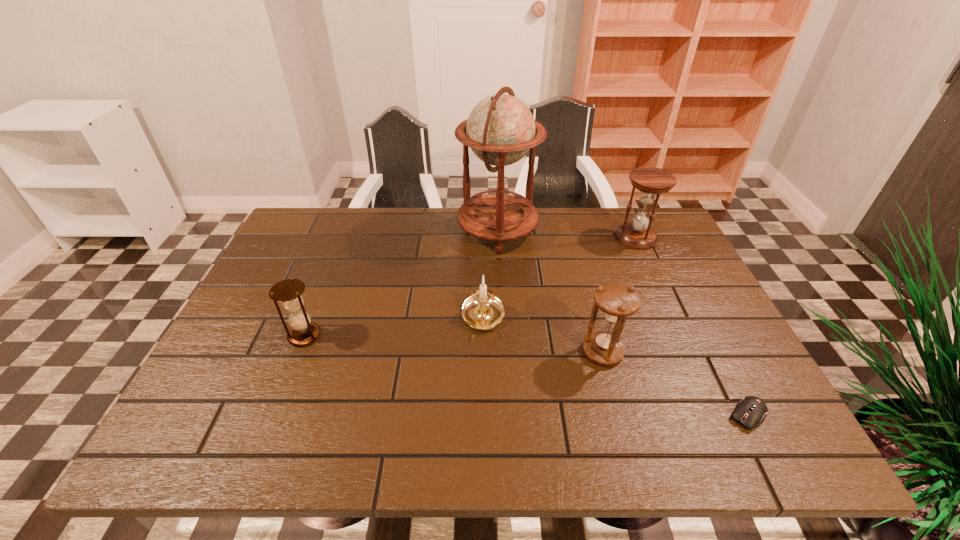
What are the coordinates of `hourglass situated at the right edge` in the screenshot? It's located at (650, 181).

Identify the location of computer mouse that is at the right edge. The image size is (960, 540). (751, 410).

Where is `object at the far right corner`? object at the far right corner is located at coordinates (650, 181).

Image resolution: width=960 pixels, height=540 pixels. I want to click on object at the near right corner, so click(751, 410).

You are a GUI agent. You are given a task and a screenshot of the screen. Output one action in this format:
    pyautogui.click(x=<x>, y=<y>)
    Task: Click on the free spot at the far edge of the desktop
    
    Given the screenshot: What is the action you would take?
    pyautogui.click(x=548, y=248)

What are the coordinates of `free spot at the near edge of the desktop` in the screenshot? It's located at (402, 429).

I want to click on free space at the left edge of the desktop, so click(308, 287).

Identify the location of vacant position at the right edge of the desktop. (710, 301).

I want to click on vacant space at the far left corner of the desktop, so click(x=306, y=227).

I want to click on free space that is in between the leftmost object and the globe, so pyautogui.click(x=401, y=283).